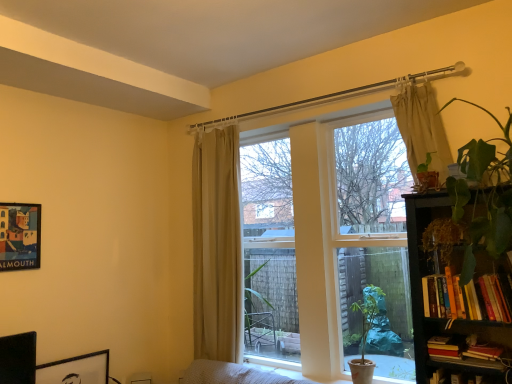
Question: Is point pos(98,352) positioned closer to the camera than point pos(23,228)?

Choices:
 (A) closer
 (B) farther

Answer: (B)

Question: Based on their positions, is black matte picture frame at lower left, the second picture frame positioned from the top, located to the left or right of matte paper picture frame at upper left, which ranks as the second picture frame in bottom-to-top order?

Choices:
 (A) right
 (B) left

Answer: (A)

Question: Which of these objects is positioned farthest from the hardcover book at lower right, which is counted as the second book, starting from the bottom?

Choices:
 (A) beige fabric curtain at center, positioned as the first curtain in back-to-front order
 (B) black matte picture frame at lower left, which is the first picture frame in bottom-to-top order
 (C) hardcover books at right, placed as the 4th book when sorted from bottom to top
 (D) beige fabric curtain at upper right, the 2th curtain viewed from the back
 (E) hardcover books at lower right, which is the fourth book in top-to-bottom order

Answer: (B)

Question: Estimate the real-world distances between objects in this image. Which object is closer to the beige fabric curtain at center, positioned as the first curtain in back-to-front order?

Choices:
 (A) hardcover book at lower right, which is counted as the second book, starting from the bottom
 (B) matte beige curtains at center
 (C) black matte picture frame at lower left, the second picture frame from the left
 (D) hardcover books at right, acting as the 1th book starting from the top
 (E) green matte houseplant at lower right

Answer: (B)